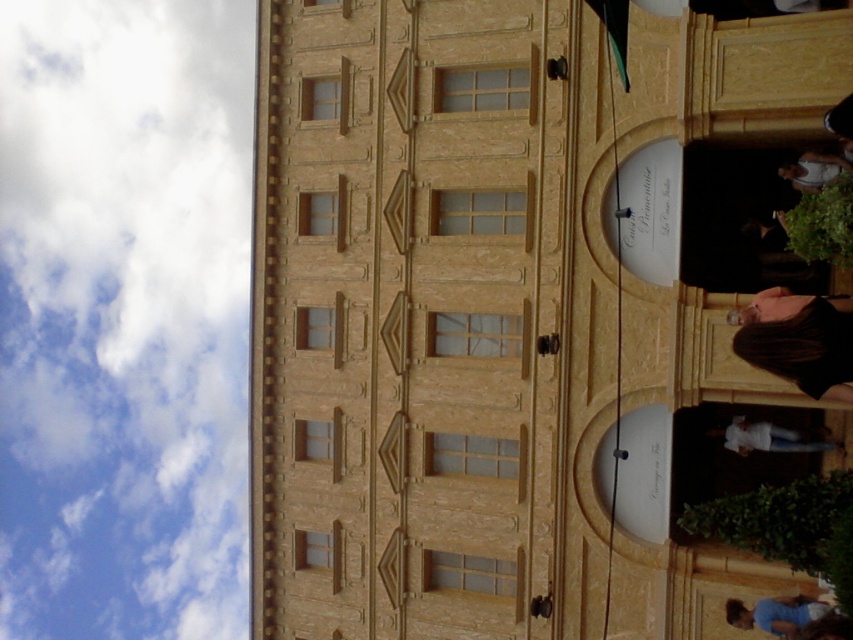
Based on the photo, is brown hair at right above blue fabric skateboarder at lower right?

Correct, brown hair at right is located above blue fabric skateboarder at lower right.

Between brown hair at right and blue fabric skateboarder at lower right, which one has more height?

brown hair at right is taller.

Measure the distance between brown hair at right and camera.

brown hair at right is 30.92 meters away from camera.

Image resolution: width=853 pixels, height=640 pixels. Find the location of `brown hair at right`. brown hair at right is located at coordinates (798, 340).

Is golden stone building at center positioned at the back of brown hair at right?

That is True.

Can you confirm if golden stone building at center is shorter than brown hair at right?

Incorrect, golden stone building at center's height does not fall short of brown hair at right's.

Does point (386, 230) come closer to viewer compared to point (776, 316)?

No, it is behind (776, 316).

In order to click on golden stone building at center in this screenshot , I will do `click(405, 317)`.

Is golden stone building at center further to camera compared to blue fabric skateboarder at lower right?

Yes, it is.

How much distance is there between golden stone building at center and blue fabric skateboarder at lower right?

golden stone building at center and blue fabric skateboarder at lower right are 11.34 meters apart from each other.

Does point (543, 147) come farther from viewer compared to point (799, 634)?

Yes, it is behind point (799, 634).

Locate an element on the screen. This screenshot has height=640, width=853. golden stone building at center is located at coordinates (405, 317).